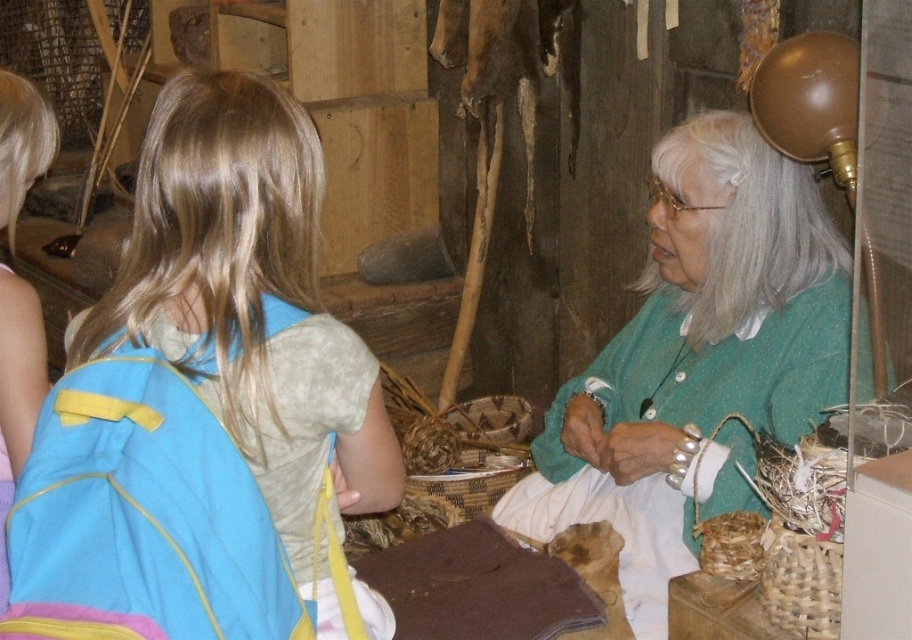
Question: Can you confirm if green knitted sweater at upper right is bigger than blue fabric backpack at left?

Choices:
 (A) yes
 (B) no

Answer: (A)

Question: Among these points, which one is farthest from the camera?

Choices:
 (A) (758, 209)
 (B) (280, 532)

Answer: (A)

Question: Is green knitted sweater at upper right smaller than blue fabric backpack at left?

Choices:
 (A) no
 (B) yes

Answer: (A)

Question: Among these points, which one is nearest to the camera?

Choices:
 (A) (606, 372)
 (B) (278, 417)

Answer: (B)

Question: Can you confirm if green knitted sweater at upper right is bigger than blue fabric backpack at left?

Choices:
 (A) no
 (B) yes

Answer: (B)

Question: Which of the following is the closest to the observer?

Choices:
 (A) blue fabric backpack at left
 (B) green knitted sweater at upper right

Answer: (A)